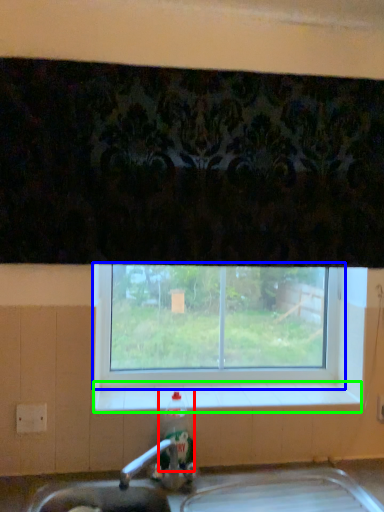
Question: Based on their relative distances, which object is nearer to bottle (highlighted by a red box)? Choose from window (highlighted by a blue box) and window sill (highlighted by a green box).

Choices:
 (A) window
 (B) window sill

Answer: (B)